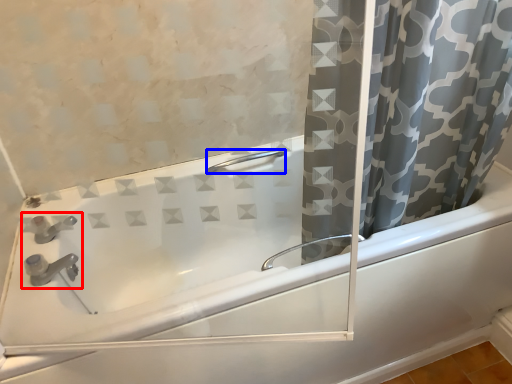
Question: Which of the following is the farthest to the observer, sink (highlighted by a red box) or shower (highlighted by a blue box)?

Choices:
 (A) sink
 (B) shower

Answer: (B)